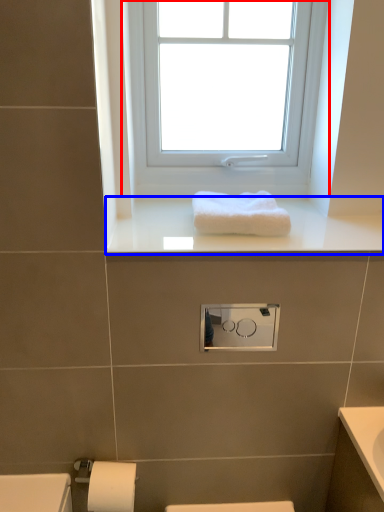
Question: Which point is closer to the camera, window (highlighted by a red box) or window sill (highlighted by a blue box)?

Choices:
 (A) window
 (B) window sill

Answer: (B)